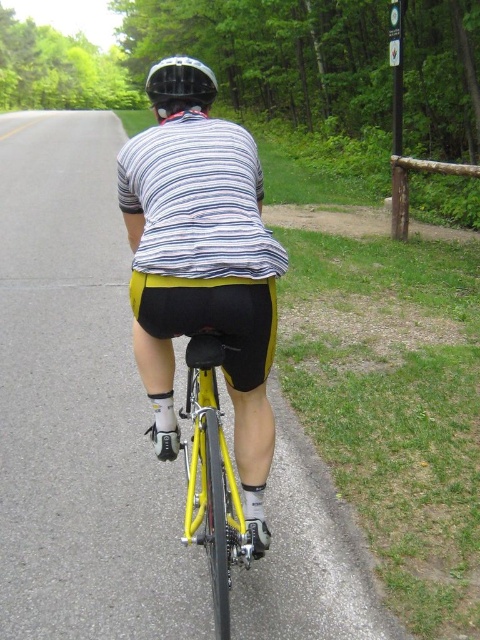
Looking at this image, you are a drone operator trying to capture a photo of the cyclist from above. The drone has a GPS coordinate system where the cyclist is at the center point. You need to place a marker at point (212, 480). Is this point on the cyclist or the bicycle?

The point (212, 480) is on the yellow matte bicycle at center, so the marker would be placed on the bicycle.

You are standing at the starting line of a cycling race and see two points marked on the track ahead. The first point is at point (235, 515) and the second is at point (168, 90). Which point is closer to your current position?

Point (235, 515) is closer to the viewer than point (168, 90), so the first point is closer to your current position.